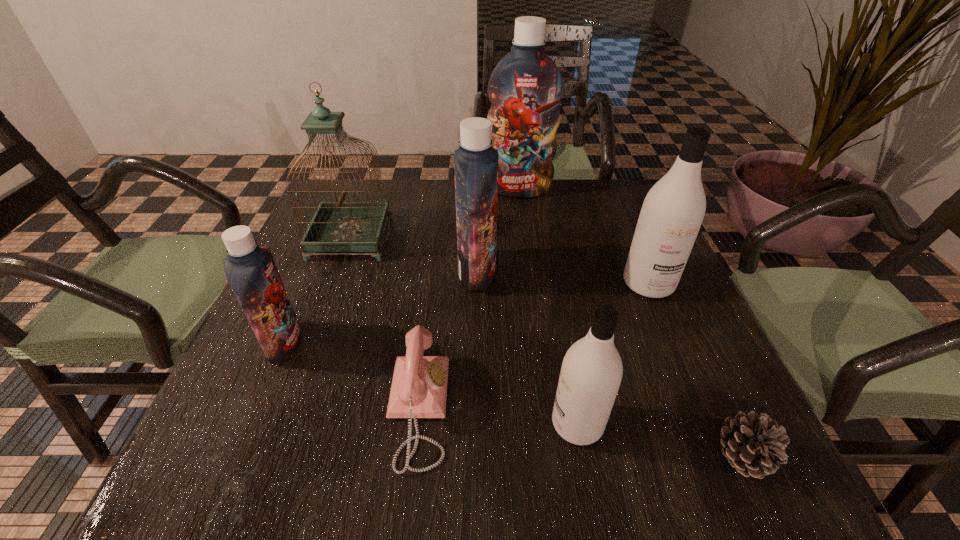
Identify the location of the tallest shampoo. (525, 88).

At what (x,y) coordinates should I click in order to perform the action: click on the biggest blue shampoo. Please return your answer as a coordinate pair (x, y). This screenshot has width=960, height=540. Looking at the image, I should click on (525, 88).

Locate an element on the screen. birdcage is located at coordinates (339, 226).

At what (x,y) coordinates should I click in order to perform the action: click on the second biggest blue shampoo. Please return your answer as a coordinate pair (x, y). This screenshot has height=540, width=960. Looking at the image, I should click on (475, 161).

What are the coordinates of `the bigger white shampoo` in the screenshot? It's located at (672, 213).

The image size is (960, 540). I want to click on the right white shampoo, so click(672, 213).

This screenshot has height=540, width=960. Identify the location of the leftmost blue shampoo. (250, 269).

This screenshot has width=960, height=540. In order to click on the nearest blue shampoo in this screenshot , I will do `click(250, 269)`.

Where is `the nearest shampoo`? The height and width of the screenshot is (540, 960). the nearest shampoo is located at coordinates (591, 372).

Where is `the left white shampoo`? The image size is (960, 540). the left white shampoo is located at coordinates (591, 372).